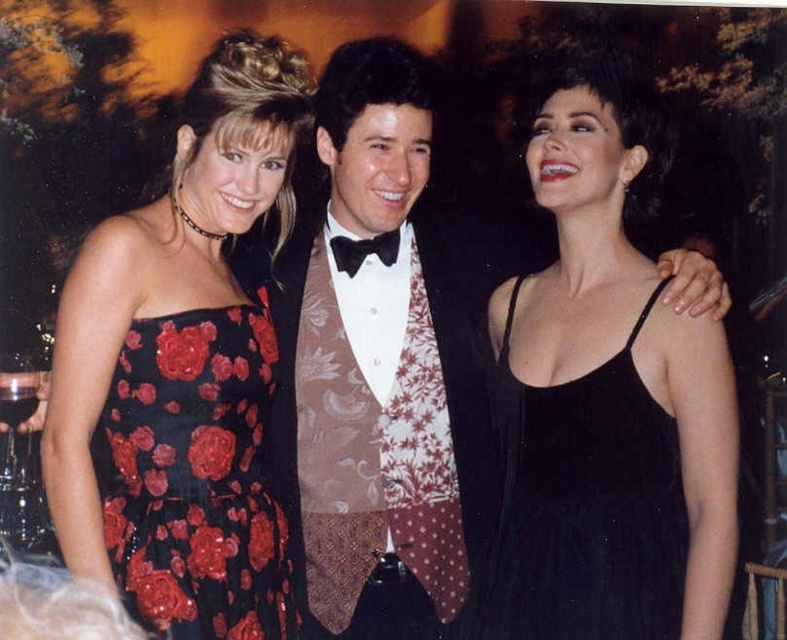
Measure the distance between point (678, 433) and camera.

Point (678, 433) and camera are 1.68 meters apart.

Is black satin dress at center positioned in front of black sequined dress at left?

Yes, it is.

Who is more forward, (619, 378) or (119, 470)?

Point (619, 378)

Where is `black satin dress at center`? black satin dress at center is located at coordinates (608, 397).

Can you confirm if black sequined dress at left is bigger than black satin bow tie at center?

Yes, black sequined dress at left is bigger than black satin bow tie at center.

Who is more distant from viewer, (239, 616) or (372, 244)?

The point (372, 244) is more distant.

Find the location of a particular element. black sequined dress at left is located at coordinates (194, 476).

Between black satin dress at center and black satin dress at left, which one has less height?

black satin dress at center is shorter.

Is black satin dress at center thinner than black satin dress at left?

Indeed, black satin dress at center has a lesser width compared to black satin dress at left.

Does point (686, 609) come in front of point (202, 490)?

Yes.

Where is `black satin dress at center`? black satin dress at center is located at coordinates (608, 397).